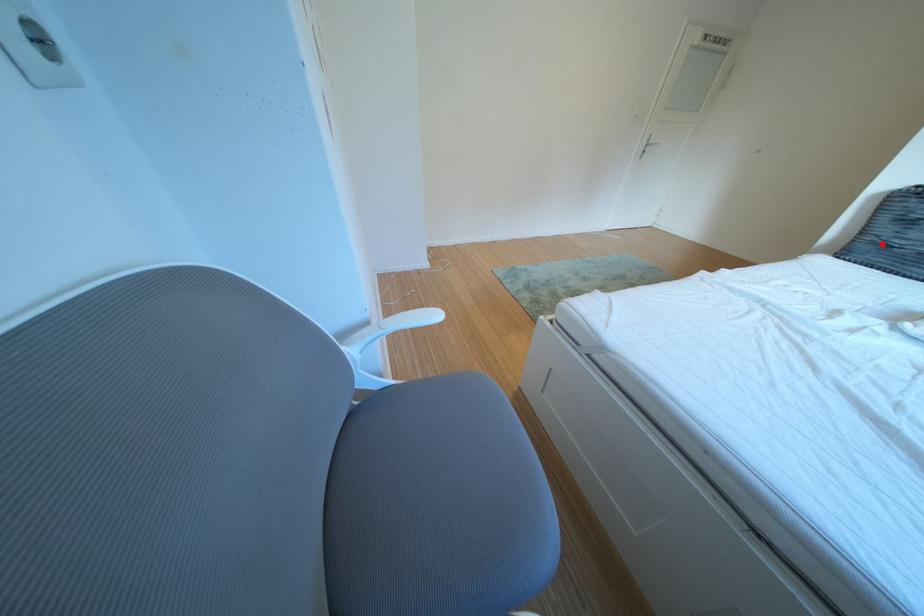
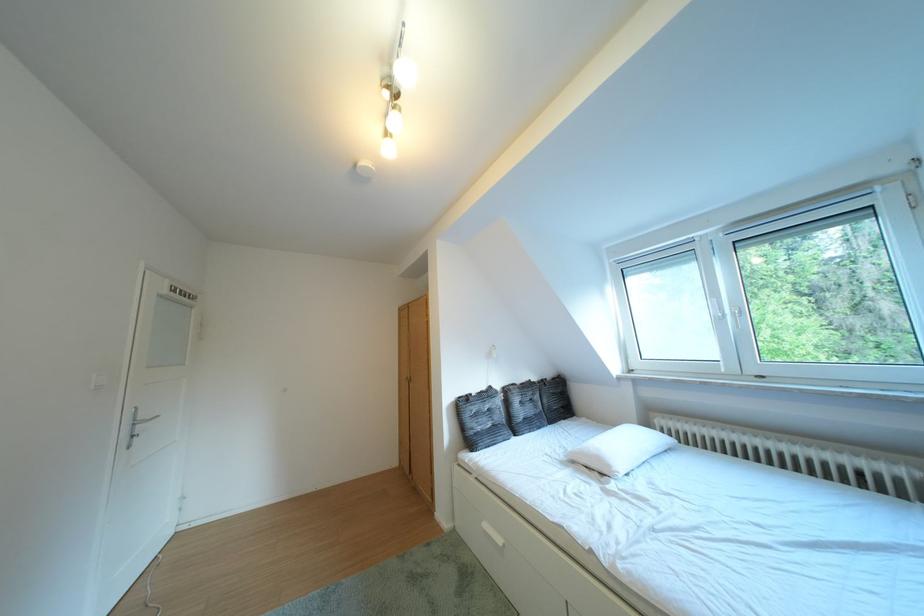
In the second image, find the point that corresponds to the highlighted location in the first image.

(484, 438)